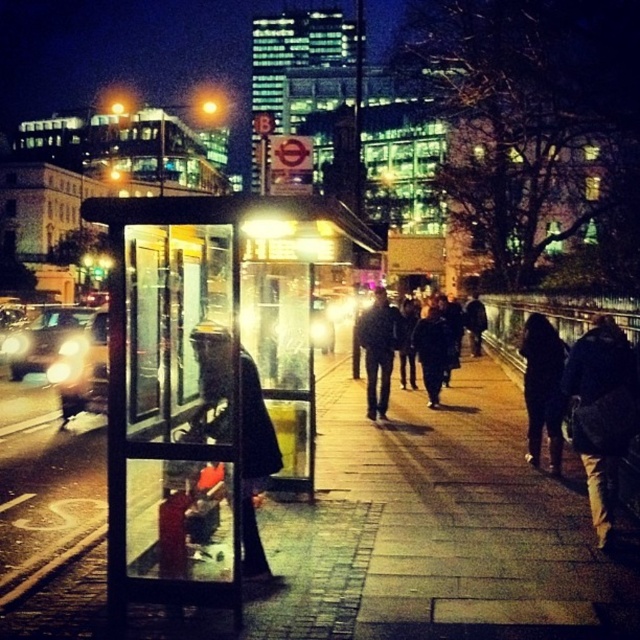
In the scene shown: Is brown leather jacket at right to the right of dark blue jacket at center from the viewer's perspective?

Indeed, brown leather jacket at right is positioned on the right side of dark blue jacket at center.

Describe the element at coordinates (602, 412) in the screenshot. This screenshot has width=640, height=640. I see `brown leather jacket at right` at that location.

Is point (572, 433) positioned in front of point (429, 358)?

Yes.

Find the location of a particular element. brown leather jacket at right is located at coordinates (602, 412).

Is brown leather jacket at right bigger than black leather jacket at center?

Incorrect, brown leather jacket at right is not larger than black leather jacket at center.

Who is positioned more to the left, brown leather jacket at right or black leather jacket at center?

black leather jacket at center is more to the left.

Does point (636, 406) come closer to viewer compared to point (268, 440)?

No.

This screenshot has height=640, width=640. I want to click on brown leather jacket at right, so click(x=602, y=412).

Which of these two, brown leather jacket at right or dark wool coat at center, stands shorter?

With less height is brown leather jacket at right.

Between brown leather jacket at right and dark wool coat at center, which one appears on the left side from the viewer's perspective?

Positioned to the left is dark wool coat at center.

Identify the location of brown leather jacket at right. This screenshot has height=640, width=640. (602, 412).